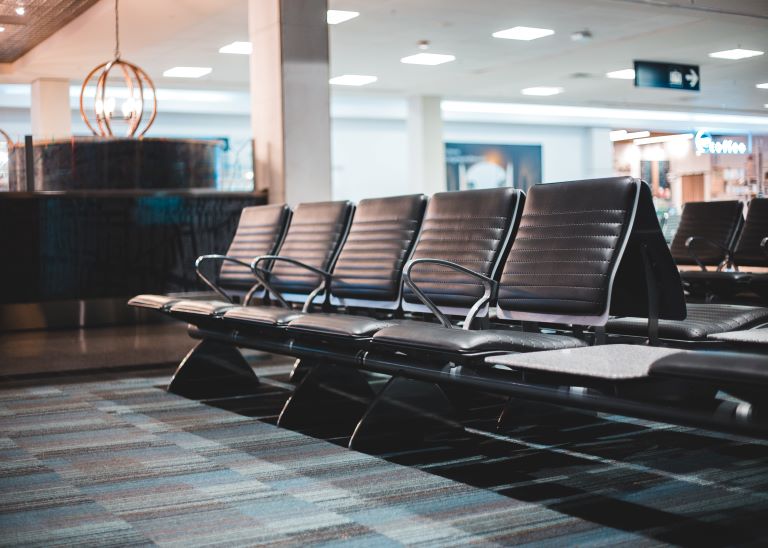
You are a GUI agent. You are given a task and a screenshot of the screen. Output one action in this format:
    pyautogui.click(x=<x>, y=<y>)
    Task: Click on the chandelier
    Image resolution: width=768 pixels, height=548 pixels.
    Given the screenshot: What is the action you would take?
    pyautogui.click(x=123, y=65)